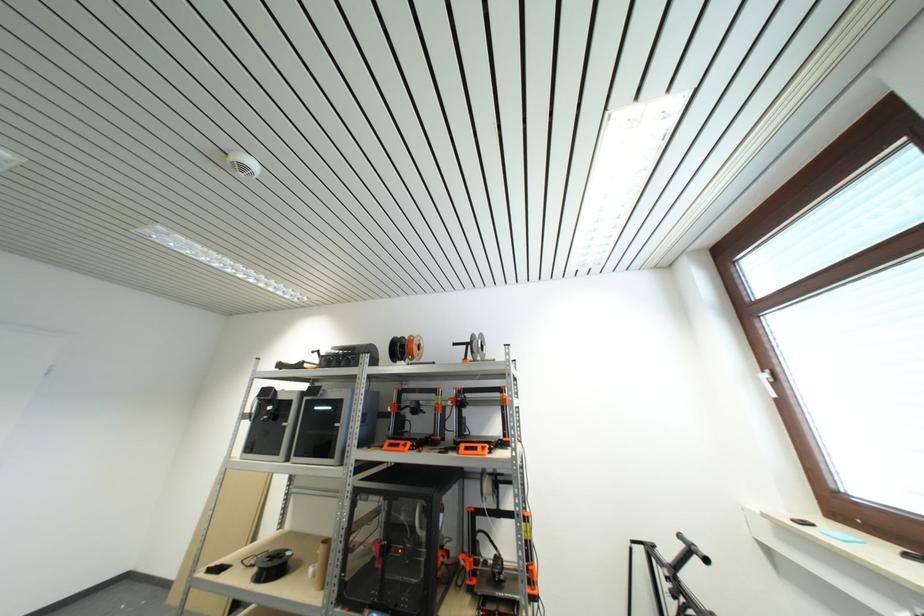
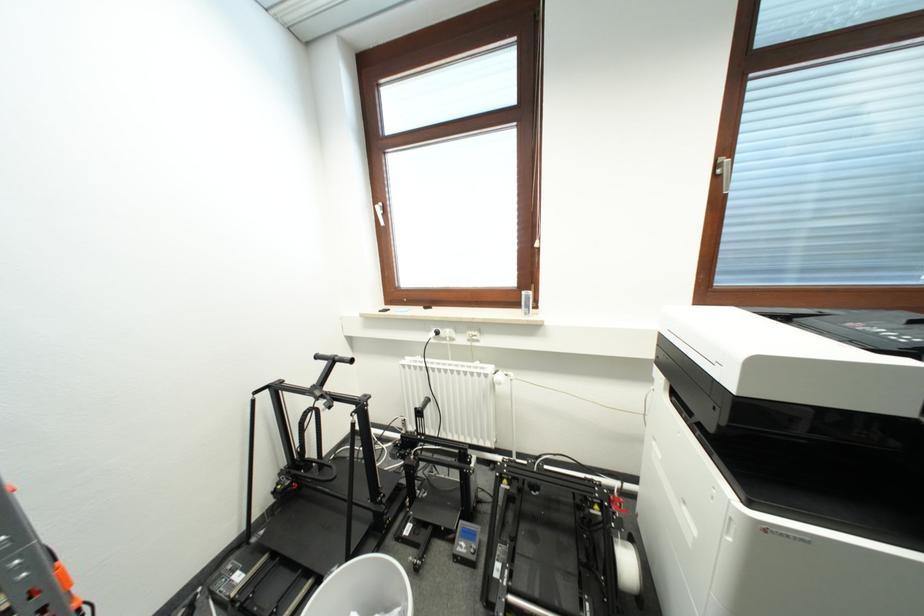
Where in the second image is the point corresponding to [685,540] from the first image?

(322, 360)